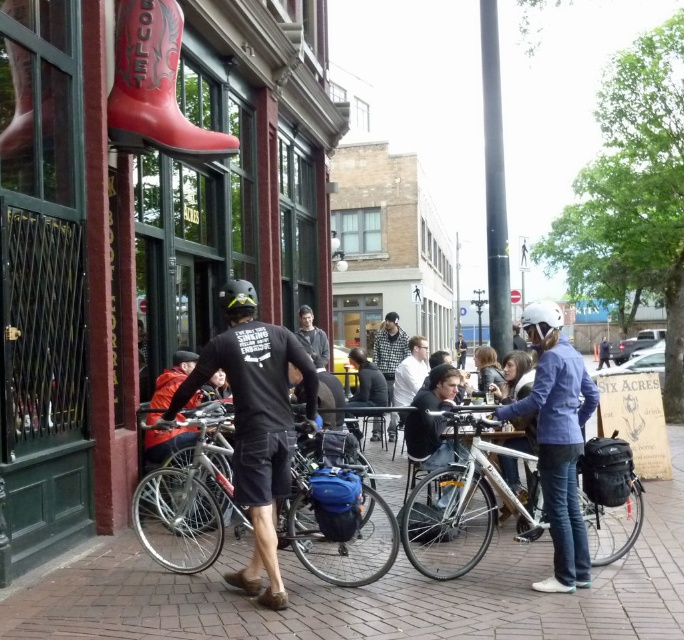
Does white matte shirt at center appear on the left side of dark gray sweater at center?

Incorrect, white matte shirt at center is not on the left side of dark gray sweater at center.

Does point (410, 385) lie in front of point (308, 342)?

Yes, it is.

Locate an element on the screen. white matte shirt at center is located at coordinates (410, 371).

Who is more forward, (637, 604) or (241, 280)?

Point (637, 604) is in front.

Which of these two, brick pavement at center or matte black helmet at center, stands shorter?

brick pavement at center is shorter.

Locate an element on the screen. brick pavement at center is located at coordinates (369, 593).

The width and height of the screenshot is (684, 640). What are the coordinates of `brick pavement at center` in the screenshot? It's located at (369, 593).

Which is in front, point (118, 611) or point (198, 424)?

Point (118, 611)

Is brick pavement at center thinner than silver metallic bicycle at center?

No, brick pavement at center is not thinner than silver metallic bicycle at center.

Locate an element on the screen. This screenshot has height=640, width=684. brick pavement at center is located at coordinates (369, 593).

What are the coordinates of `brick pavement at center` in the screenshot? It's located at (369, 593).